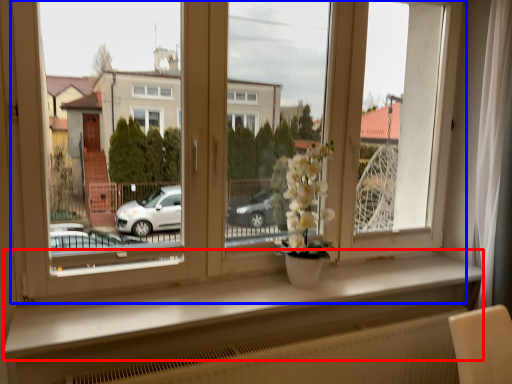
Question: Among these objects, which one is farthest to the camera, window sill (highlighted by a red box) or window (highlighted by a blue box)?

Choices:
 (A) window sill
 (B) window

Answer: (B)